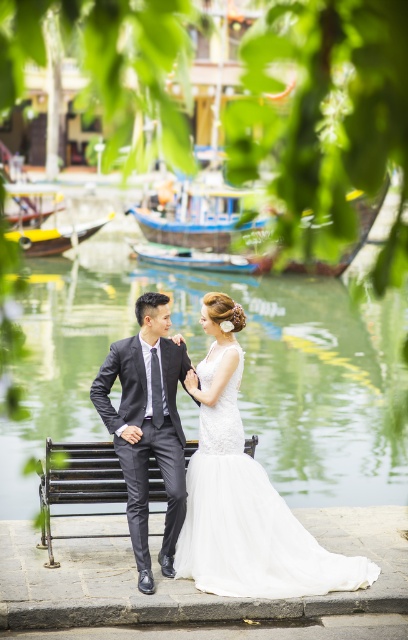
Consider the image. Can you confirm if clear water at bench center is taller than wooden boat at lower left?

Yes, clear water at bench center is taller than wooden boat at lower left.

Who is more distant from viewer, (292, 474) or (64, 232)?

The point (64, 232) is behind.

Where is `clear water at bench center`? Image resolution: width=408 pixels, height=640 pixels. clear water at bench center is located at coordinates (197, 360).

Between white lace dress at center and dark gray suit at center, which one appears on the left side from the viewer's perspective?

dark gray suit at center

Is white lace dress at center bigger than dark gray suit at center?

Yes, white lace dress at center is bigger than dark gray suit at center.

You are a GUI agent. You are given a task and a screenshot of the screen. Output one action in this format:
    pyautogui.click(x=<x>, y=<y>)
    Task: Click on the white lace dress at center
    This screenshot has width=408, height=640.
    Given the screenshot: What is the action you would take?
    pyautogui.click(x=244, y=493)

Based on the photo, between dark gray suit at center and black metal bench at center, which one is positioned lower?

black metal bench at center is below.

Consider the image. Does dark gray suit at center have a lesser height compared to black metal bench at center?

No.

Where is `dark gray suit at center`? The image size is (408, 640). dark gray suit at center is located at coordinates (146, 426).

Identify the location of dark gray suit at center. The image size is (408, 640). (146, 426).